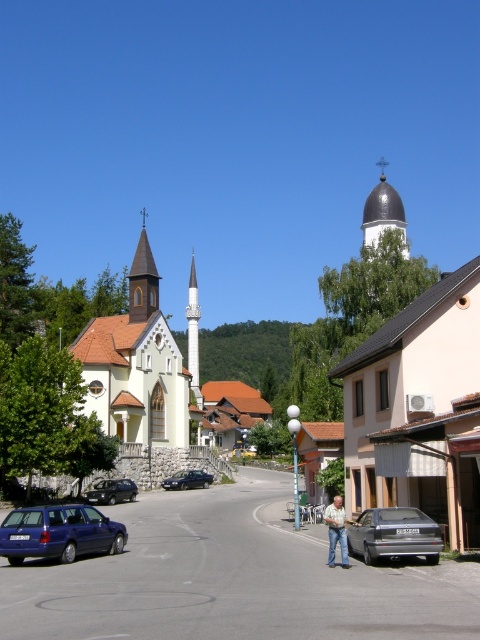
Between point (48, 540) and point (145, 234), which one is positioned behind?

Positioned behind is point (145, 234).

How far apart are metallic blue station wagon at lower left and brown wooden spire at upper left?

They are 70.52 meters apart.

Who is more distant from viewer, [13,550] or [143,227]?

Positioned behind is point [143,227].

The image size is (480, 640). What are the coordinates of `metallic blue station wagon at lower left` in the screenshot? It's located at (59, 532).

Can you confirm if matte black car at center-left is thinner than dark blue metallic sedan at center?

Correct, matte black car at center-left's width is less than dark blue metallic sedan at center's.

Who is positioned more to the left, matte black car at center-left or dark blue metallic sedan at center?

Positioned to the left is matte black car at center-left.

Is point (95, 499) positioned after point (186, 480)?

No.

Where is `matte black car at center-left`? Image resolution: width=480 pixels, height=640 pixels. matte black car at center-left is located at coordinates (111, 492).

Consider the image. Can you confirm if silver metallic sedan at center is smaller than shiny dark gray dome at center?

Yes.

Does silver metallic sedan at center have a greater height compared to shiny dark gray dome at center?

Incorrect, silver metallic sedan at center's height is not larger of shiny dark gray dome at center's.

The width and height of the screenshot is (480, 640). What are the coordinates of `silver metallic sedan at center` in the screenshot? It's located at (394, 534).

Identify the location of silver metallic sedan at center. The height and width of the screenshot is (640, 480). (394, 534).